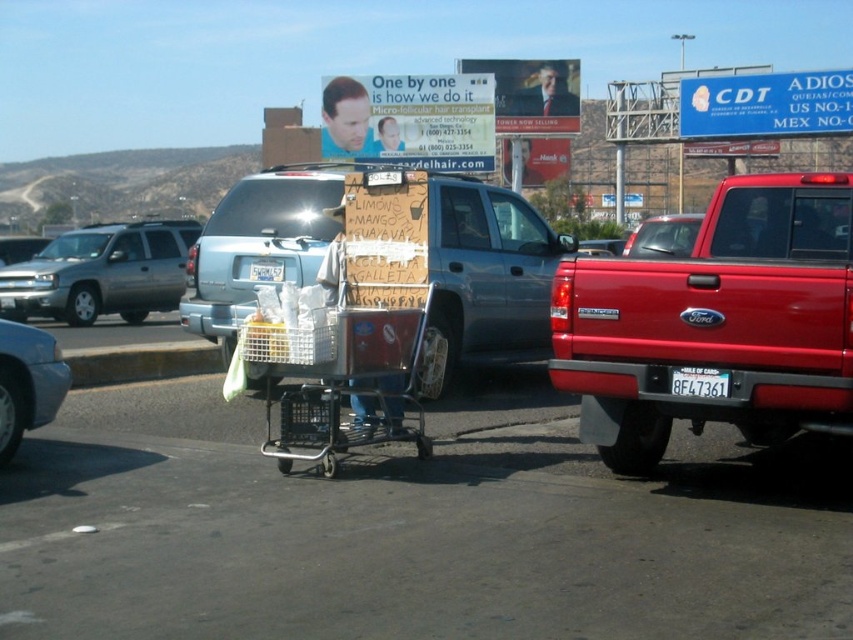
Question: Which point is farther to the camera?

Choices:
 (A) metallic blue shopping cart at center
 (B) shiny red pickup truck at right
 (C) white plastic license plate at center
 (D) metallic silver sedan at lower left

Answer: (C)

Question: Can you confirm if metallic silver cart at center is positioned to the right of metallic blue shopping cart at center?

Choices:
 (A) no
 (B) yes

Answer: (A)

Question: Which object appears closest to the camera in this image?

Choices:
 (A) black plastic license plate at lower center
 (B) silver metallic suv at left
 (C) metallic blue shopping cart at center
 (D) shiny red pickup truck at right

Answer: (D)

Question: Can you confirm if blue plastic sign at upper right is wider than metallic silver sedan at lower left?

Choices:
 (A) yes
 (B) no

Answer: (A)

Question: Can you confirm if shiny red pickup truck at right is bigger than white plastic license plate at center?

Choices:
 (A) no
 (B) yes

Answer: (B)

Question: Which object is farther from the camera taking this photo?

Choices:
 (A) metallic silver sedan at lower left
 (B) blue plastic sign at upper right

Answer: (B)